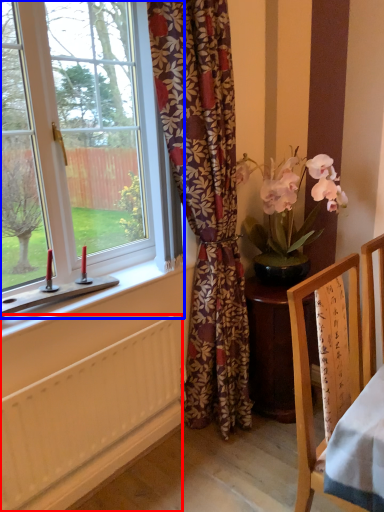
Question: Which object is further to the camera taking this photo, radiator (highlighted by a red box) or window (highlighted by a blue box)?

Choices:
 (A) radiator
 (B) window

Answer: (A)